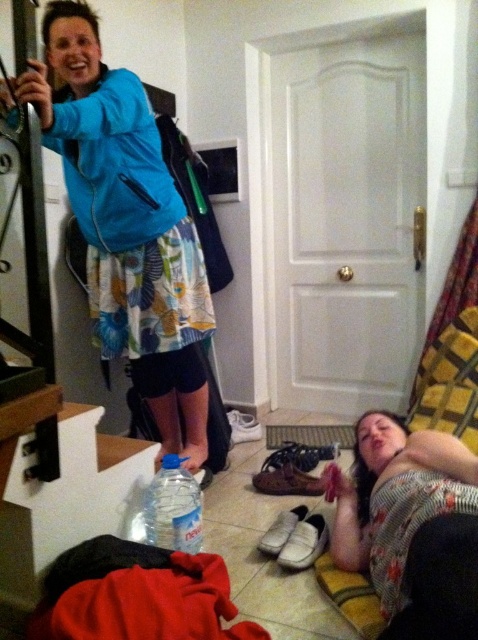
Consider the image. You are at a party and need to grab a drink. You see the blue matte jacket at upper left and the clear plastic water bottle at lower center. Which object is closer to your right side if you are facing the image?

The clear plastic water bottle at lower center is closer to your right side because it is positioned to the right of the blue matte jacket at upper left.

You are a delivery person who needs to place a small package between the floral fabric shirt at lower right and the clear plastic water bottle at lower center. Which object should you place the package closer to if you want it to be near the larger item?

The floral fabric shirt at lower right is larger than the clear plastic water bottle at lower center, so you should place the package closer to the floral fabric shirt at lower right.

You are an interior designer assessing the spatial compatibility of the blue matte jacket at upper left and the floral fabric shirt at lower right for a photoshoot. Given their sizes, which object would require more storage space when not in use?

The blue matte jacket at upper left requires more storage space because it is larger in size than the floral fabric shirt at lower right.